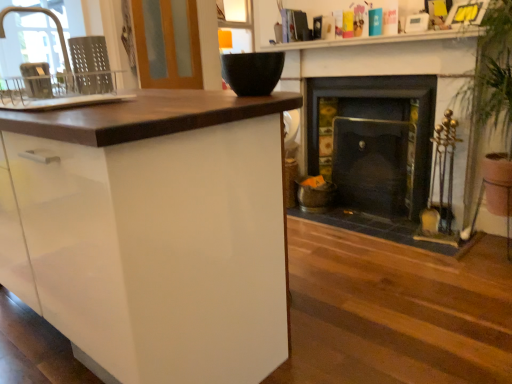
Image resolution: width=512 pixels, height=384 pixels. Find the location of `free location in front of metallic gray dish rack at left, the 1th appliance from the left`. free location in front of metallic gray dish rack at left, the 1th appliance from the left is located at coordinates (34, 101).